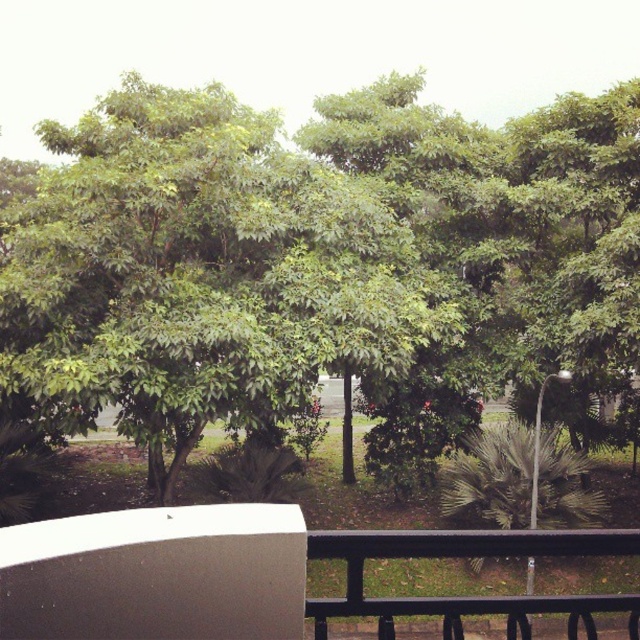
You are standing on a balcony and see a point labeled as point (x=321, y=262). What object does this point correspond to in the scene?

The point (x=321, y=262) corresponds to the green leafy tree at center.

You are standing on the white matte balcony at lower left and want to look at the green leafy tree at center. In which direction should you turn your head to see it?

The green leafy tree at center is positioned on the left side of white matte balcony at lower left, so you should turn your head to the left to see it.